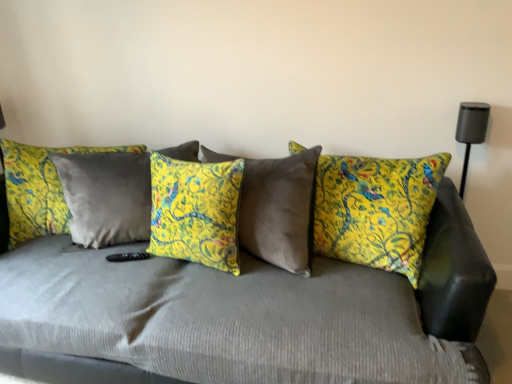
Question: Should I look upward or downward to see yellow floral pillow at center, placed as the third pillow when sorted from right to left?

Choices:
 (A) down
 (B) up

Answer: (B)

Question: Can you confirm if velvet gray couch at center is shorter than yellow floral cushion at center, positioned as the 3th pillow in left-to-right order?

Choices:
 (A) yes
 (B) no

Answer: (B)

Question: Is velvet gray couch at center further to the viewer compared to yellow floral cushion at center, placed as the first pillow when sorted from right to left?

Choices:
 (A) no
 (B) yes

Answer: (A)

Question: Is velvet gray couch at center in contact with yellow floral cushion at center, placed as the first pillow when sorted from right to left?

Choices:
 (A) no
 (B) yes

Answer: (A)

Question: Considering the relative sizes of velvet gray couch at center and yellow floral cushion at center, positioned as the 3th pillow in left-to-right order, in the image provided, is velvet gray couch at center smaller than yellow floral cushion at center, positioned as the 3th pillow in left-to-right order,?

Choices:
 (A) yes
 (B) no

Answer: (B)

Question: Does velvet gray couch at center have a greater width compared to yellow floral cushion at center, positioned as the 3th pillow in left-to-right order?

Choices:
 (A) yes
 (B) no

Answer: (A)

Question: Is velvet gray couch at center positioned beyond the bounds of yellow floral cushion at center, placed as the first pillow when sorted from right to left?

Choices:
 (A) yes
 (B) no

Answer: (A)

Question: Is yellow floral cushion at center, placed as the first pillow when sorted from right to left, not within velvet gray couch at center?

Choices:
 (A) no
 (B) yes

Answer: (A)

Question: From the image's perspective, is yellow floral cushion at center, positioned as the 3th pillow in left-to-right order, below velvet gray couch at center?

Choices:
 (A) no
 (B) yes

Answer: (A)

Question: Can you confirm if yellow floral cushion at center, placed as the first pillow when sorted from right to left, is taller than velvet gray couch at center?

Choices:
 (A) no
 (B) yes

Answer: (A)

Question: From a real-world perspective, is yellow floral cushion at center, positioned as the 3th pillow in left-to-right order, below velvet gray couch at center?

Choices:
 (A) yes
 (B) no

Answer: (B)

Question: From a real-world perspective, is yellow floral cushion at center, placed as the first pillow when sorted from right to left, on velvet gray couch at center?

Choices:
 (A) no
 (B) yes

Answer: (B)

Question: Does yellow floral cushion at center, positioned as the 3th pillow in left-to-right order, have a lesser height compared to velvet gray couch at center?

Choices:
 (A) yes
 (B) no

Answer: (A)

Question: From a real-world perspective, is velvet gray couch at center located beneath yellow floral pillow at center, which is counted as the first pillow, starting from the left?

Choices:
 (A) no
 (B) yes

Answer: (B)